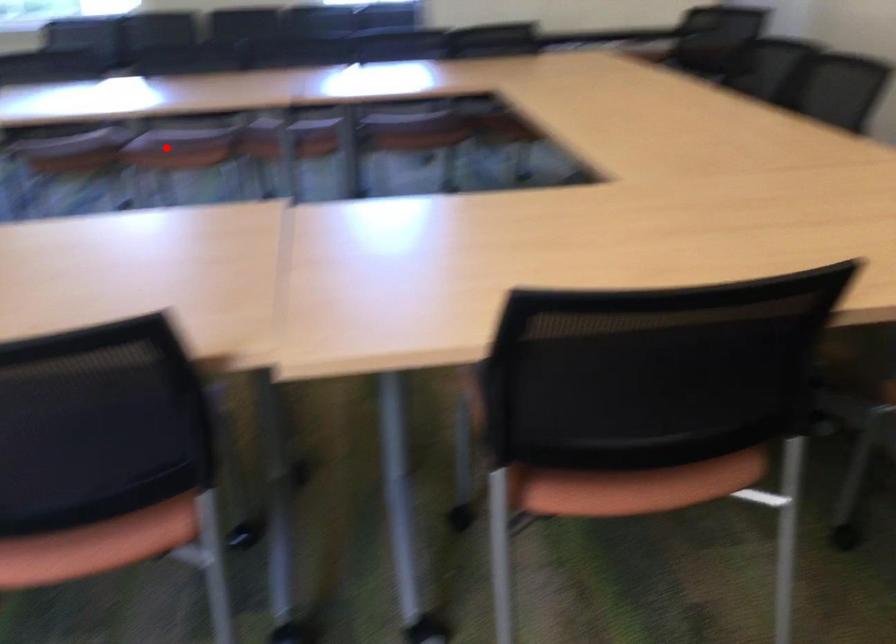
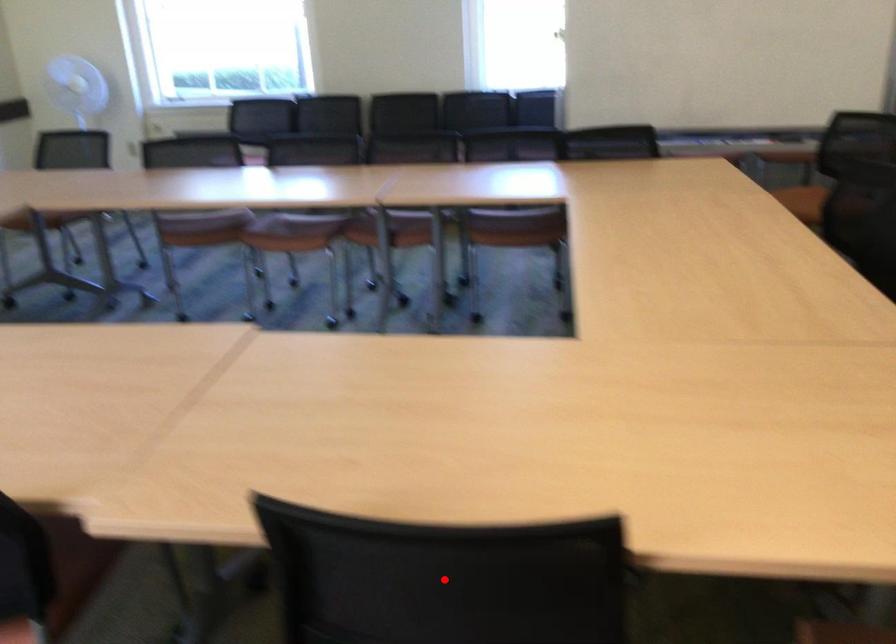
I am providing you with two images of the same scene from different viewpoints. A red point is marked on the first image and another point is marked on the second image. Is the marked point in image1 the same physical position as the marked point in image2?

No